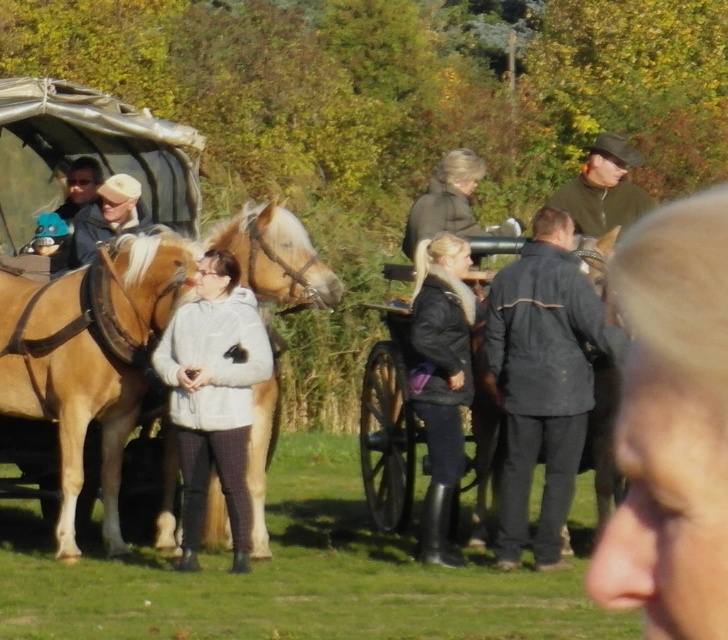
You are a photographer standing in front of the light brown leather horse at center and the black leather jacket at center. You want to take a photo focusing on the horse first. Which object should you adjust your camera to focus on first?

The light brown leather horse at center is closer to the viewer than the black leather jacket at center, so you should focus on the light brown leather horse at center first to ensure it is in sharp focus.

You are standing at the origin point in the scene. Where is the light brown leather horse at center located in terms of coordinates?

The light brown leather horse at center is located at coordinates point (68, 394).

You are a photographer standing near the wooden wagon at center and want to take a photo of the smooth beige coat at center. Which direction should you move to ensure the coat is in the frame?

The smooth beige coat at center is positioned on the right side of the wooden wagon at center, so you should move to the right side of the wooden wagon at center to capture the coat in your photo.